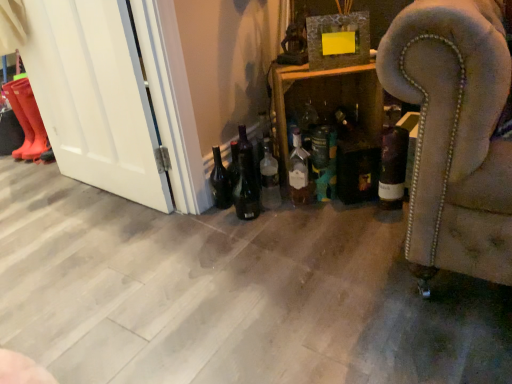
Question: From a real-world perspective, is matte glass bottle at center, which is counted as the 4th bottle, starting from the right, positioned above or below black glass beer bottle at lower center, which ranks as the second beer bottle in left-to-right order?

Choices:
 (A) below
 (B) above

Answer: (B)

Question: Does point (288, 180) appear closer or farther from the camera than point (232, 190)?

Choices:
 (A) closer
 (B) farther

Answer: (B)

Question: Estimate the real-world distances between objects in this image. Which object is farther from the dark glass bottle at center-right, which ranks as the fifth bottle in left-to-right order?

Choices:
 (A) white glossy door at left
 (B) rubber boots at left, which is the 1th boot from right to left
 (C) rubber boots at left, the first boot viewed from the left
 (D) matte glass bottle at center, which appears as the 2th bottle when viewed from the left
 (E) translucent glass bottle at center, which is the 5th bottle from right to left

Answer: (C)

Question: Considering the real-world distances, which object is closest to the matte glass bottle at lower left, placed as the 2th beer bottle when sorted from right to left?

Choices:
 (A) wooden shelf at center
 (B) matte glass bottle at center, which appears as the 2th bottle when viewed from the left
 (C) dark glass bottle at center-right, the 1th bottle positioned from the right
 (D) rubber boots at left, the 2th boot viewed from the right
 (E) black glass beer bottle at lower center, acting as the first beer bottle starting from the right

Answer: (E)